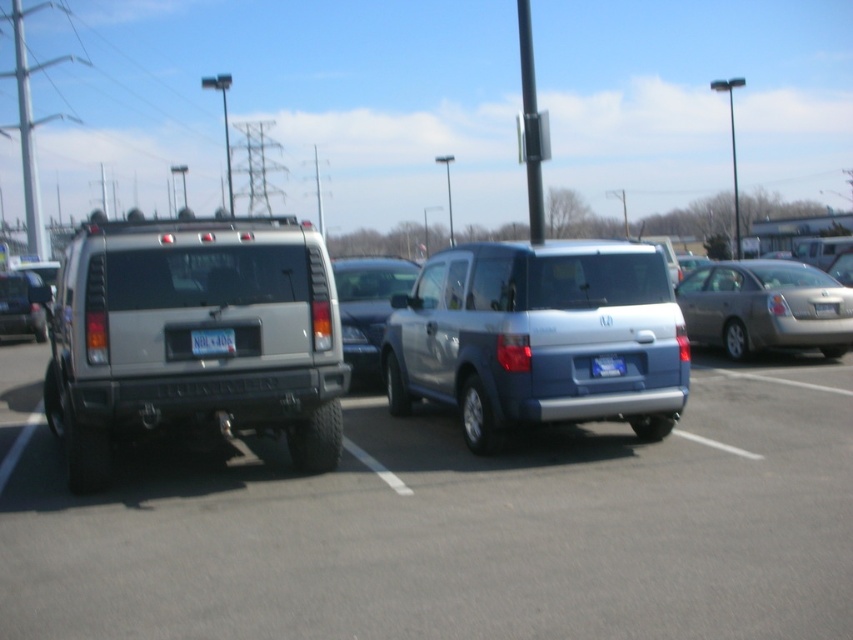
You are standing at the point marked by the coordinates point (538, 337) in the parking lot. Which vehicle is directly in front of you?

The satin silver minivan at center is directly in front of you at point (538, 337).

You are standing at the center of the parking lot and want to locate the silver metallic suv at left. According to the coordinates given, in which direction should you look to find it?

The silver metallic suv at left is located at coordinates point (x=189, y=337), so you should look to the left side of the parking lot to find it.